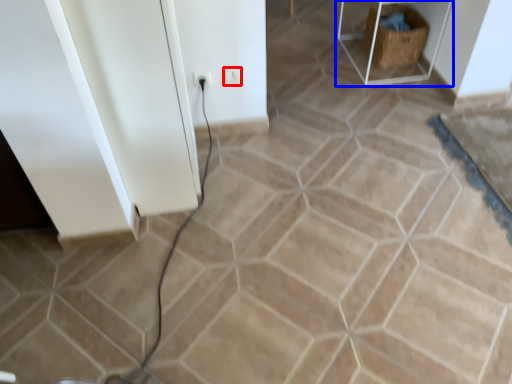
Question: Which object appears farthest to the camera in this image, electric outlet (highlighted by a red box) or furniture (highlighted by a blue box)?

Choices:
 (A) electric outlet
 (B) furniture

Answer: (B)